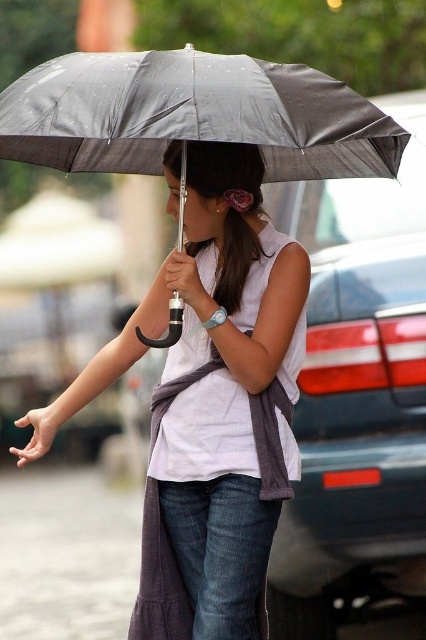
You are a delivery person who needs to choose between the matte gray umbrella at upper center and the metallic gray umbrella at center to protect your package from the rain. Which umbrella would provide better coverage due to its height?

The matte gray umbrella at upper center is much taller than the metallic gray umbrella at center, so it would provide better coverage for the package.

You are standing in the scene and want to move from point (238, 632) to point (282, 68). Which direction should you face to walk towards the destination?

To move from point (238, 632) to point (282, 68), you should face towards the left since point (282, 68) is located to the left of point (238, 632).

What are the coordinates of the matte gray umbrella at upper center?

The coordinates of the matte gray umbrella at upper center are at point (x=212, y=403).